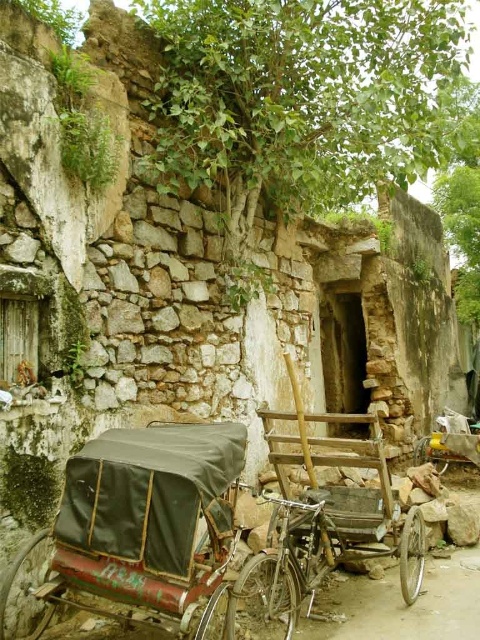
You are a painter planning to paint the scene. You want to focus on the rusty metal rickshaw at lower left and the rusty metal rickshaw at center. Which rickshaw should you choose to paint if you have limited canvas space and want to capture the entire object without cropping?

The rusty metal rickshaw at lower left occupies less space than the rusty metal rickshaw at center, so you should choose the rusty metal rickshaw at lower left to paint if you have limited canvas space and want to capture the entire object without cropping.